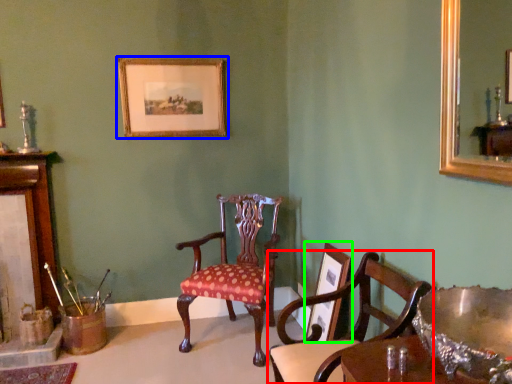
Question: Which object is positioned farthest from chair (highlighted by a red box)? Select from picture frame (highlighted by a blue box) and picture frame (highlighted by a green box).

Choices:
 (A) picture frame
 (B) picture frame

Answer: (A)